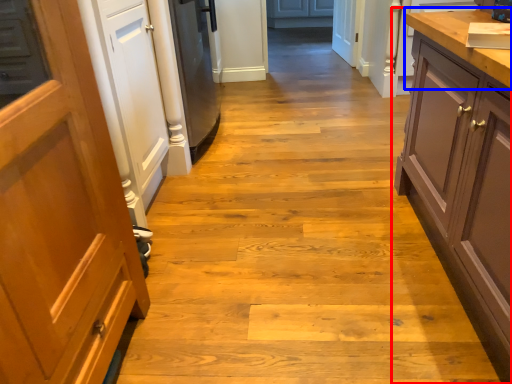
Question: Which object appears closest to the camera in this image, cabinetry (highlighted by a red box) or countertop (highlighted by a blue box)?

Choices:
 (A) cabinetry
 (B) countertop

Answer: (A)